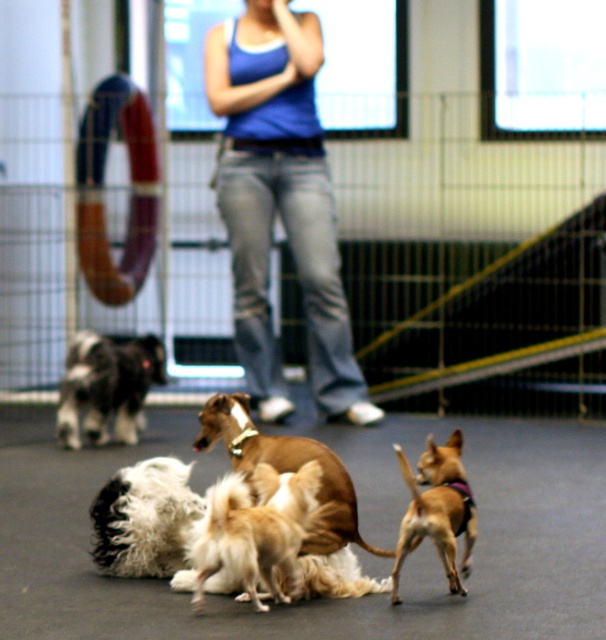
Does golden fur dog at center appear on the left side of black and white fur at left?

No, golden fur dog at center is not to the left of black and white fur at left.

What do you see at coordinates (253, 532) in the screenshot?
I see `golden fur dog at center` at bounding box center [253, 532].

At what (x,y) coordinates should I click in order to perform the action: click on golden fur dog at center. Please return your answer as a coordinate pair (x, y). This screenshot has height=640, width=606. Looking at the image, I should click on (253, 532).

Which of these two, blue denim jeans at center or light brown fur at center, stands taller?

Standing taller between the two is blue denim jeans at center.

Measure the distance between blue denim jeans at center and camera.

A distance of 38.18 feet exists between blue denim jeans at center and camera.

Find the location of a particular element. This screenshot has height=640, width=606. blue denim jeans at center is located at coordinates (281, 204).

Which of these two, blue denim jeans at center or golden fur dog at center, stands shorter?

golden fur dog at center

Is point (230, 64) positioned after point (298, 540)?

Yes.

What do you see at coordinates (281, 204) in the screenshot?
I see `blue denim jeans at center` at bounding box center [281, 204].

The image size is (606, 640). Identify the location of blue denim jeans at center. 281,204.